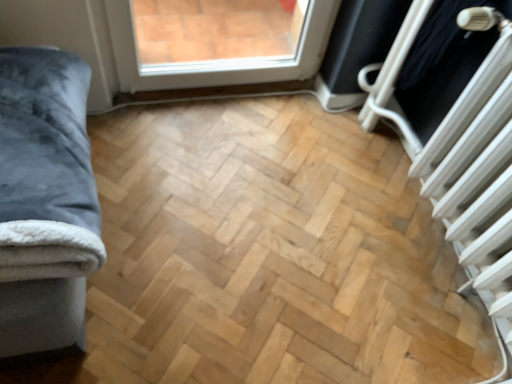
This screenshot has width=512, height=384. What do you see at coordinates (465, 160) in the screenshot?
I see `white metallic radiator at right` at bounding box center [465, 160].

What do you see at coordinates (45, 200) in the screenshot? I see `velvet grey blanket at left` at bounding box center [45, 200].

In order to face white plastic radiator at upper right, should I rotate leftwards or rightwards?

Rotate right and turn 24.002 degrees.

Locate an element on the screen. white metallic radiator at right is located at coordinates (465, 160).

Are white metallic radiator at right and white plastic radiator at upper right beside each other?

No, white metallic radiator at right is not with white plastic radiator at upper right.

In terms of width, does white metallic radiator at right look wider or thinner when compared to white plastic radiator at upper right?

white metallic radiator at right is wider than white plastic radiator at upper right.

From a real-world perspective, which object rests below the other?

white metallic radiator at right, from a real-world perspective.

Does white metallic radiator at right have a greater height compared to white plastic radiator at upper right?

Yes.

From the image's perspective, between white metallic radiator at right and velvet grey blanket at left, which one is located above?

velvet grey blanket at left is shown above in the image.

Is white metallic radiator at right to the left of velvet grey blanket at left from the viewer's perspective?

In fact, white metallic radiator at right is to the right of velvet grey blanket at left.

From a real-world perspective, is white metallic radiator at right on velvet grey blanket at left?

Incorrect, from a real-world perspective, white metallic radiator at right is lower than velvet grey blanket at left.

How distant is white metallic radiator at right from velvet grey blanket at left?

A distance of 1.05 meters exists between white metallic radiator at right and velvet grey blanket at left.

How distant is velvet grey blanket at left from white metallic radiator at right?

velvet grey blanket at left is 1.05 meters from white metallic radiator at right.

In the scene shown: Considering the positions of objects velvet grey blanket at left and white metallic radiator at right in the image provided, who is more to the left, velvet grey blanket at left or white metallic radiator at right?

velvet grey blanket at left.

Is velvet grey blanket at left oriented towards white metallic radiator at right?

Yes, velvet grey blanket at left is aimed at white metallic radiator at right.

Relative to white metallic radiator at right, is velvet grey blanket at left in front or behind?

In the image, velvet grey blanket at left appears in front of white metallic radiator at right.

Is velvet grey blanket at left positioned before white plastic radiator at upper right?

Yes, velvet grey blanket at left is closer to the camera.

I want to click on screen door on the right side of velvet grey blanket at left, so click(444, 77).

From a real-world perspective, between velvet grey blanket at left and white plastic radiator at upper right, who is vertically higher?

white plastic radiator at upper right.

Is velvet grey blanket at left far from white plastic radiator at upper right?

Yes, velvet grey blanket at left and white plastic radiator at upper right are located far from each other.

From the picture: Considering the sizes of objects white plastic radiator at upper right and velvet grey blanket at left in the image provided, who is taller, white plastic radiator at upper right or velvet grey blanket at left?

white plastic radiator at upper right is taller.

Based on their positions, is white plastic radiator at upper right located to the left or right of velvet grey blanket at left?

Clearly, white plastic radiator at upper right is on the right of velvet grey blanket at left in the image.

From a real-world perspective, who is located higher, white plastic radiator at upper right or velvet grey blanket at left?

In real-world perspective, white plastic radiator at upper right is above.

Which is behind, point (413, 132) or point (13, 141)?

The point (413, 132) is farther.

Which is nearer, (492, 49) or (457, 201)?

Point (492, 49) is positioned farther from the camera compared to point (457, 201).

Consider the image. Considering the positions of objects white plastic radiator at upper right and white metallic radiator at right in the image provided, who is in front, white plastic radiator at upper right or white metallic radiator at right?

white metallic radiator at right is more forward.

From the picture: Is white plastic radiator at upper right at the left side of white metallic radiator at right?

Yes, white plastic radiator at upper right is to the left of white metallic radiator at right.

Which of these two, white plastic radiator at upper right or white metallic radiator at right, stands taller?

white metallic radiator at right.

At what (x,y) coordinates should I click in order to perform the action: click on screen door located above the white metallic radiator at right (from a real-world perspective). Please return your answer as a coordinate pair (x, y). Image resolution: width=512 pixels, height=384 pixels. Looking at the image, I should click on (444, 77).

Find the location of `furniture located in front of the white metallic radiator at right`. furniture located in front of the white metallic radiator at right is located at coordinates (45, 200).

Estimate the real-world distances between objects in this image. Which object is further from white metallic radiator at right, velvet grey blanket at left or white plastic radiator at upper right?

Among the two, velvet grey blanket at left is located further to white metallic radiator at right.

Looking at the image, which one is located closer to white plastic radiator at upper right, white metallic radiator at right or velvet grey blanket at left?

Among the two, white metallic radiator at right is located nearer to white plastic radiator at upper right.

Considering their positions, is velvet grey blanket at left positioned further to white plastic radiator at upper right than white metallic radiator at right?

Based on the image, velvet grey blanket at left appears to be further to white plastic radiator at upper right.

When comparing their distances from velvet grey blanket at left, does white metallic radiator at right or white plastic radiator at upper right seem further?

white plastic radiator at upper right lies further to velvet grey blanket at left than the other object.

Estimate the real-world distances between objects in this image. Which object is further from velvet grey blanket at left, white plastic radiator at upper right or white metallic radiator at right?

Among the two, white plastic radiator at upper right is located further to velvet grey blanket at left.

Estimate the real-world distances between objects in this image. Which object is further from white metallic radiator at right, white plastic radiator at upper right or velvet grey blanket at left?

velvet grey blanket at left lies further to white metallic radiator at right than the other object.

Image resolution: width=512 pixels, height=384 pixels. I want to click on screen door between velvet grey blanket at left and white metallic radiator at right, so click(444, 77).